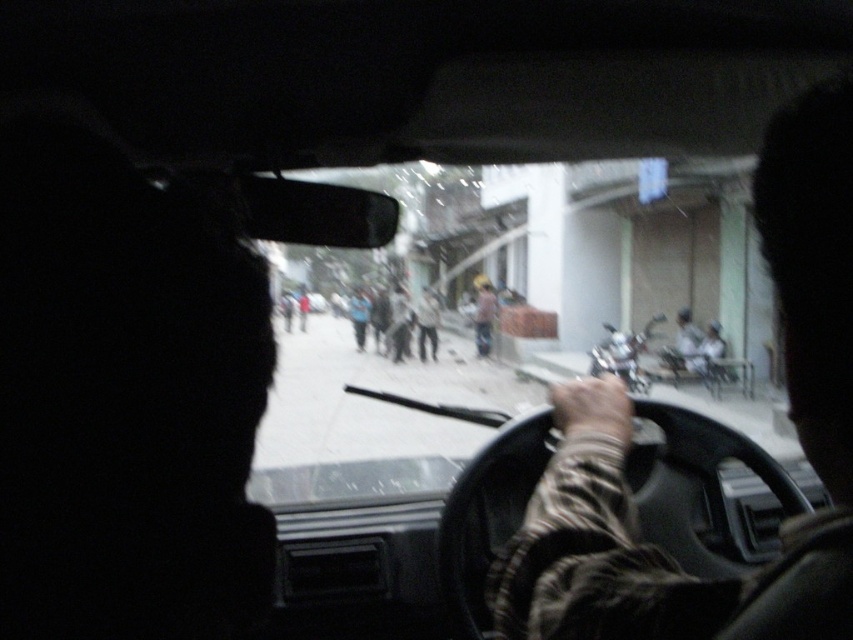
You are sitting in the driver seat of a car and want to check if the transparent glass windshield at center is directly in front of you. Based on its coordinates, can you confirm if it is centered?

The transparent glass windshield at center is located at coordinates point (x=473, y=317), which is very close to the center point of the image, so yes, it is directly in front of you.

You are sitting in the driver seat of the car and want to see the blue fabric person at center outside. Can you see them through the transparent glass windshield at center?

Yes, the transparent glass windshield at center is in front of the blue fabric person at center, so you can see them through the windshield.

You are inside a car and want to check the weather outside through the transparent glass windshield at center. Since the windshield is transparent, can you see the weather conditions clearly?

Yes, since the transparent glass windshield at center is transparent, you can see the weather conditions clearly through it.